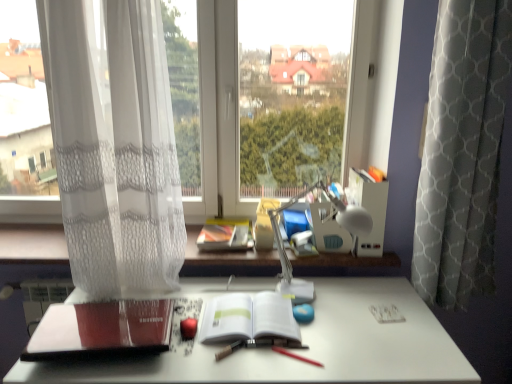
Question: From a real-world perspective, is red matte book at lower left, marked as the 2th paperback book in a right-to-left arrangement, located beneath white paper at center, marked as the 2th paperback book in a left-to-right arrangement?

Choices:
 (A) no
 (B) yes

Answer: (A)

Question: From the image's perspective, is red matte book at lower left, positioned as the 1th paperback book in left-to-right order, on top of white paper at center, marked as the 2th paperback book in a left-to-right arrangement?

Choices:
 (A) no
 (B) yes

Answer: (A)

Question: Is red matte book at lower left, positioned as the 1th paperback book in left-to-right order, touching white paper at center, placed as the 1th paperback book when sorted from right to left?

Choices:
 (A) no
 (B) yes

Answer: (A)

Question: Does red matte book at lower left, marked as the 2th paperback book in a right-to-left arrangement, have a lesser height compared to white paper at center, placed as the 1th paperback book when sorted from right to left?

Choices:
 (A) yes
 (B) no

Answer: (B)

Question: From the image's perspective, is red matte book at lower left, positioned as the 1th paperback book in left-to-right order, under white paper at center, placed as the 1th paperback book when sorted from right to left?

Choices:
 (A) yes
 (B) no

Answer: (A)

Question: Would you say red matte book at lower left, marked as the 2th paperback book in a right-to-left arrangement, is outside white paper at center, marked as the 2th paperback book in a left-to-right arrangement?

Choices:
 (A) yes
 (B) no

Answer: (A)

Question: Is transparent glass window at center at the right side of white sheer curtain at left, positioned as the first curtain in left-to-right order?

Choices:
 (A) no
 (B) yes

Answer: (A)

Question: From the image's perspective, is transparent glass window at center located beneath white sheer curtain at left, the second curtain from the right?

Choices:
 (A) no
 (B) yes

Answer: (A)

Question: Can you confirm if transparent glass window at center is taller than white sheer curtain at left, the second curtain from the right?

Choices:
 (A) yes
 (B) no

Answer: (B)

Question: Is transparent glass window at center aimed at white sheer curtain at left, the second curtain from the right?

Choices:
 (A) no
 (B) yes

Answer: (B)

Question: From a real-world perspective, does transparent glass window at center sit lower than white sheer curtain at left, positioned as the first curtain in left-to-right order?

Choices:
 (A) yes
 (B) no

Answer: (B)

Question: From a real-world perspective, is transparent glass window at center on top of white sheer curtain at left, the second curtain from the right?

Choices:
 (A) no
 (B) yes

Answer: (B)

Question: Could you tell me if white matte desk at center is facing white sheer curtain at left, the second curtain from the right?

Choices:
 (A) yes
 (B) no

Answer: (B)